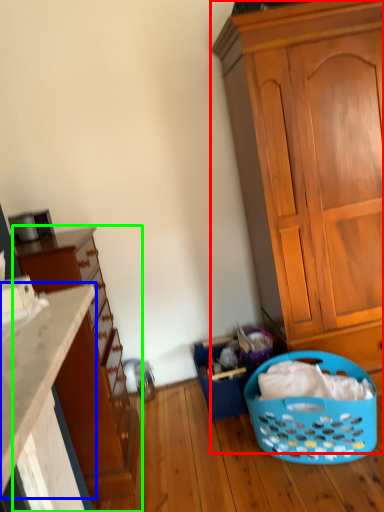
Question: Estimate the real-world distances between objects in this image. Which object is closer to cabinetry (highlighted by a red box), countertop (highlighted by a blue box) or cupboard (highlighted by a green box)?

Choices:
 (A) countertop
 (B) cupboard

Answer: (B)